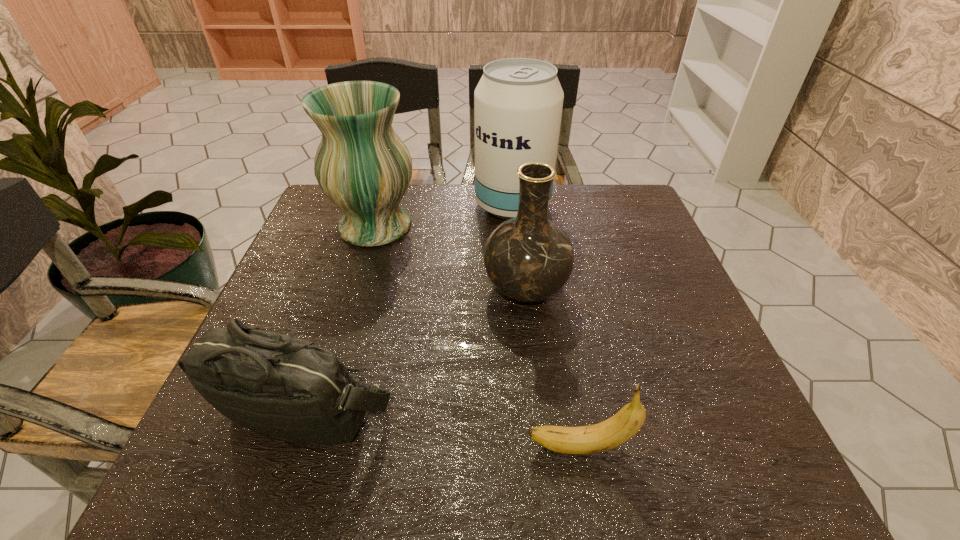
In order to click on free space that is in between the nearer vase and the banana in this screenshot , I will do `click(553, 368)`.

The width and height of the screenshot is (960, 540). I want to click on vacant region between the alcohol and the shoulder bag, so click(x=409, y=307).

This screenshot has width=960, height=540. In order to click on free spot between the shoulder bag and the alcohol in this screenshot , I will do `click(409, 307)`.

You are a GUI agent. You are given a task and a screenshot of the screen. Output one action in this format:
    pyautogui.click(x=<x>, y=<y>)
    Task: Click on the unoccupied area between the shortest object and the shoulder bag
    The image size is (960, 540).
    Given the screenshot: What is the action you would take?
    point(443,428)

You are a GUI agent. You are given a task and a screenshot of the screen. Output one action in this format:
    pyautogui.click(x=<x>, y=<y>)
    Task: Click on the object identified as the second closest to the shortest object
    
    Given the screenshot: What is the action you would take?
    pyautogui.click(x=528, y=258)

Identify which object is located as the fourth nearest to the alcohol. Please provide its 2D coordinates. Your answer should be formatted as a tuple, i.e. [(x, y)], where the tuple contains the x and y coordinates of a point satisfying the conditions above.

[(608, 434)]

You are a GUI agent. You are given a task and a screenshot of the screen. Output one action in this format:
    pyautogui.click(x=<x>, y=<y>)
    Task: Click on the vacant space that satisfies the following two spatial constraints: 1. on the front side of the alcohol; 2. on the left side of the third farthest object
    
    Given the screenshot: What is the action you would take?
    pyautogui.click(x=521, y=289)

I want to click on free location that satisfies the following two spatial constraints: 1. on the front side of the nearer vase; 2. on the left side of the left vase, so click(356, 289).